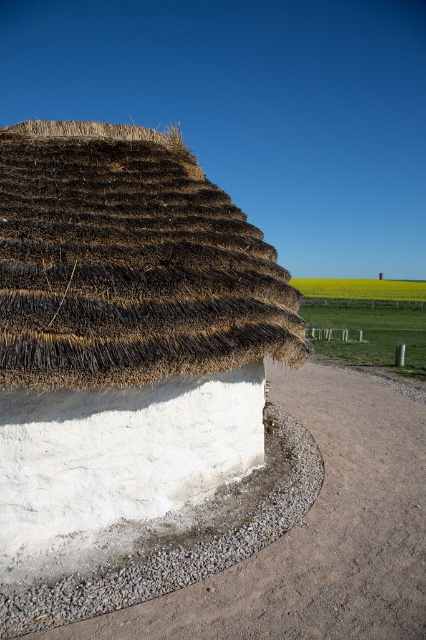
You are standing at the base of the thatched roof structure and want to place two decorative stones at the coordinates point (106, 252) and point (166, 572). Which stone will be closer to the viewer when placed?

Point (166, 572) will be closer to the viewer because point (106, 252) is behind it.

You are standing in a garden and see the thatched straw hut at center and the gray gravel at lower center. Which object is closer to you?

The gray gravel at lower center is closer to you because the thatched straw hut at center is further away from you.

You are a visitor standing in front of the thatched straw hut at center and the gray gravel at lower center. Which object is larger in size?

The thatched straw hut at center is bigger than gray gravel at lower center, so the thatched straw hut at center is larger in size.